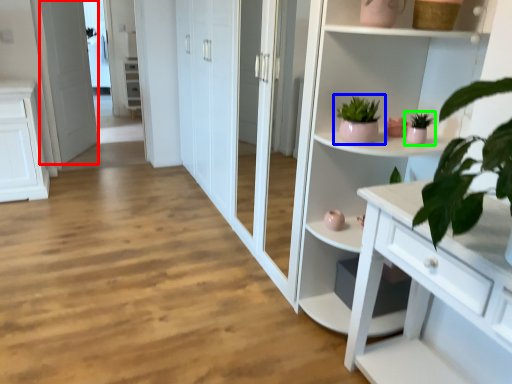
Question: Considering the real-world distances, which object is closest to screen door (highlighted by a red box)? houseplant (highlighted by a blue box) or houseplant (highlighted by a green box).

Choices:
 (A) houseplant
 (B) houseplant

Answer: (A)